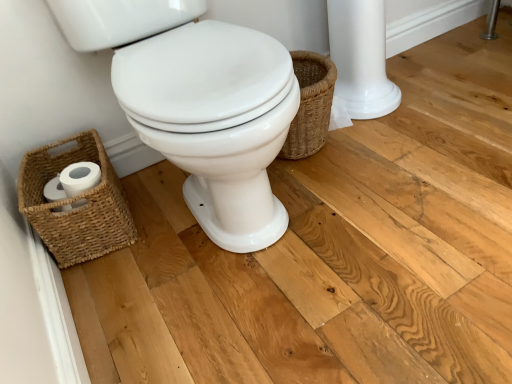
You are a GUI agent. You are given a task and a screenshot of the screen. Output one action in this format:
    pyautogui.click(x=<x>, y=<y>)
    Task: Click on the vacant space in front of woven brown basket at lower left
    The height and width of the screenshot is (384, 512).
    Given the screenshot: What is the action you would take?
    pyautogui.click(x=119, y=289)